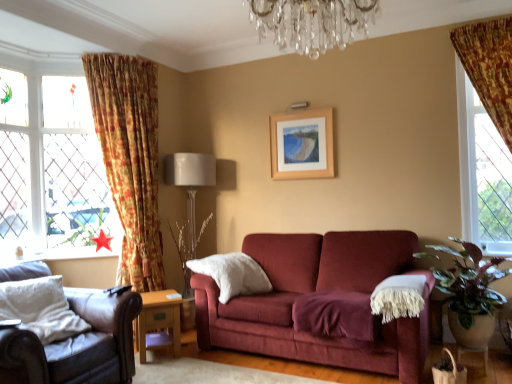
Question: In terms of width, does leather armchair at lower left look wider or thinner when compared to red paper star at lower left?

Choices:
 (A) thin
 (B) wide

Answer: (B)

Question: From a real-world perspective, relative to red paper star at lower left, is leather armchair at lower left vertically above or below?

Choices:
 (A) above
 (B) below

Answer: (B)

Question: Estimate the real-world distances between objects in this image. Which object is farther from the crystal chandelier at upper center?

Choices:
 (A) leather armchair at lower left
 (B) floral fabric curtain at left
 (C) wooden picture frame at upper center
 (D) white fabric lampshade at center
 (E) green leafy plant at right

Answer: (D)

Question: Which object is the closest to the clear glass window at left?

Choices:
 (A) green leafy plant at right
 (B) white soft pillow at center
 (C) leather armchair at lower left
 (D) wooden side table at lower center
 (E) crystal chandelier at upper center

Answer: (D)